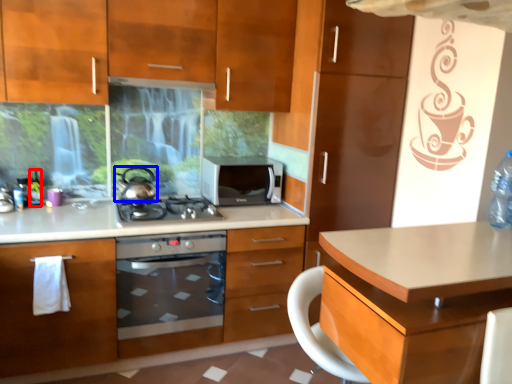
Question: Among these objects, which one is farthest to the camera, bottle (highlighted by a red box) or kitchen appliance (highlighted by a blue box)?

Choices:
 (A) bottle
 (B) kitchen appliance

Answer: (A)